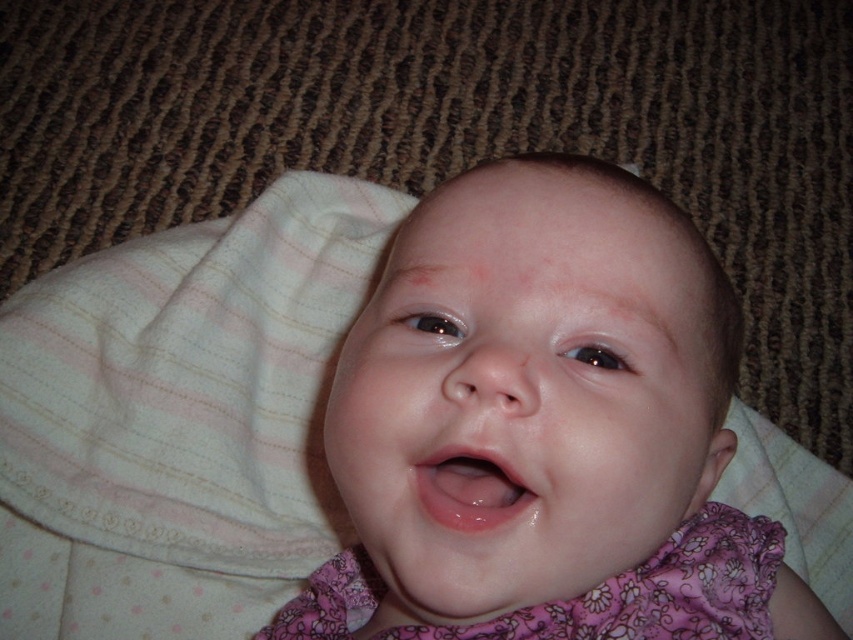
You are a photographer setting up for a baby photoshoot. The baby is wearing a pink floral fabric dress at center and lying on a white striped fabric at center. To ensure the dress is clearly visible, which fabric should be closer to the camera?

The white striped fabric at center should be closer to the camera because the pink floral fabric dress at center is behind it, making the striped fabric more prominent in the foreground.

You are a photographer setting up a shoot for a baby photo session. You need to position a prop to the right of the pink floral fabric dress at center. Based on the scene description, where should you place the prop relative to the white striped fabric at center?

The white striped fabric at center is to the left of the pink floral fabric dress at center, so you should place the prop to the right of the pink floral fabric dress at center, which is to the right of the white striped fabric at center.

The baby is wearing a pink floral fabric dress at center and has glossy pink lips at center. Which of these two items is bigger?

The pink floral fabric dress at center is larger in size than the glossy pink lips at center.